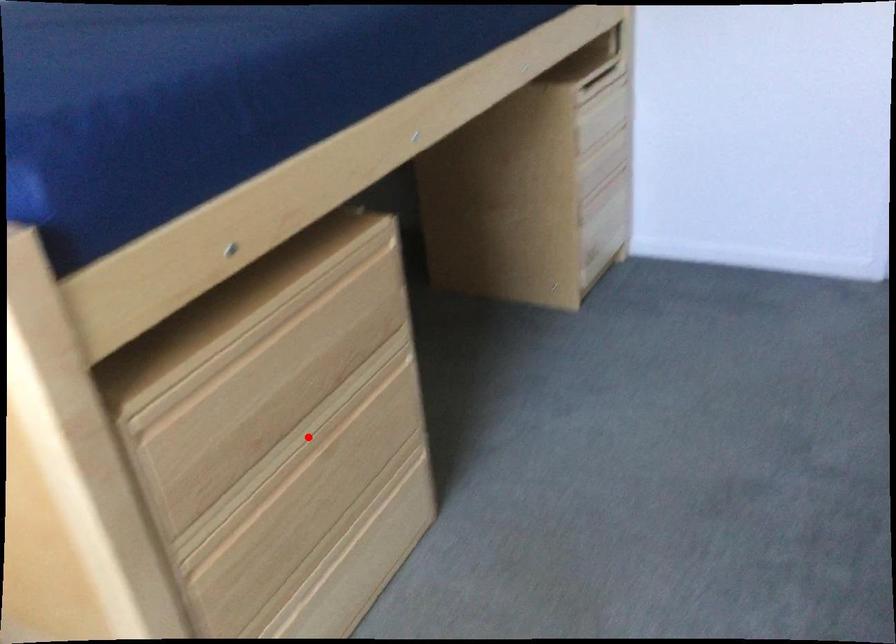
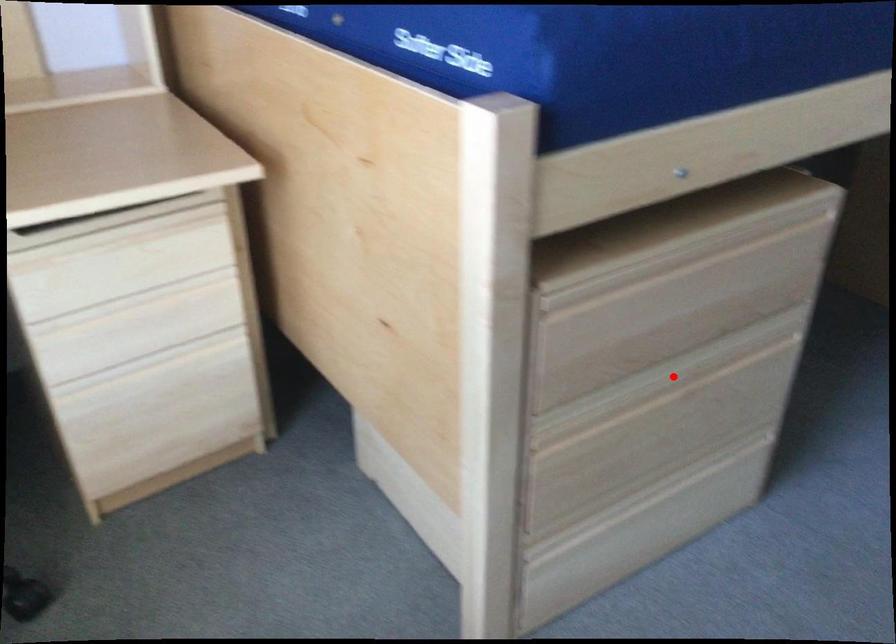
Based on the photo, I am providing you with two images of the same scene from different viewpoints. A red point is marked on the first image and another point is marked on the second image. Is the red point in image1 aligned with the point shown in image2?

Yes